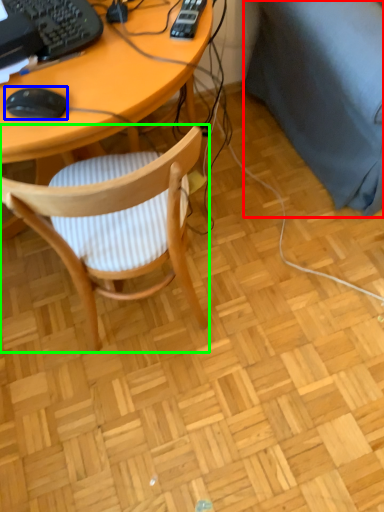
Question: Estimate the real-world distances between objects in this image. Which object is farther from couch (highlighted by a red box), mouse (highlighted by a blue box) or chair (highlighted by a green box)?

Choices:
 (A) mouse
 (B) chair

Answer: (A)